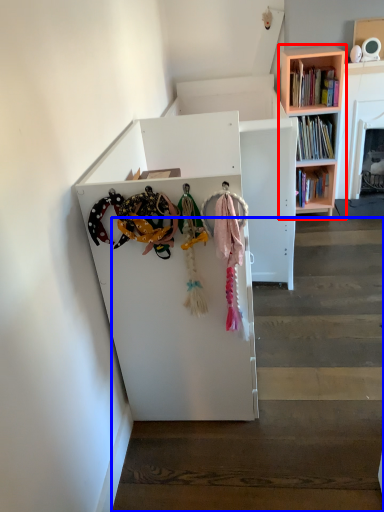
Question: Which object is closer to the camera taking this photo, bookcase (highlighted by a red box) or stairwell (highlighted by a blue box)?

Choices:
 (A) bookcase
 (B) stairwell

Answer: (B)